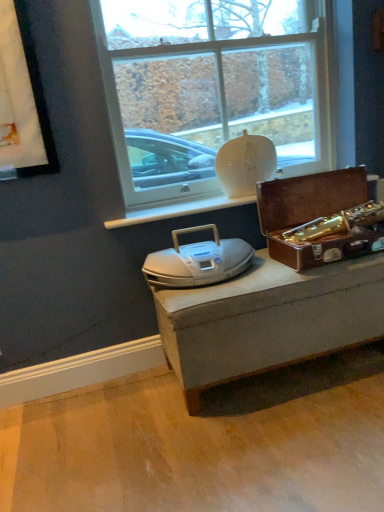
Question: Does white matte vase at upper center appear on the left side of white plastic stereo at center?

Choices:
 (A) yes
 (B) no

Answer: (B)

Question: Is white matte vase at upper center positioned beyond the bounds of white plastic stereo at center?

Choices:
 (A) yes
 (B) no

Answer: (A)

Question: Is white matte vase at upper center bigger than white plastic stereo at center?

Choices:
 (A) yes
 (B) no

Answer: (A)

Question: Does white matte vase at upper center come behind white plastic stereo at center?

Choices:
 (A) yes
 (B) no

Answer: (A)

Question: Does white matte vase at upper center have a smaller size compared to white plastic stereo at center?

Choices:
 (A) no
 (B) yes

Answer: (A)

Question: From a real-world perspective, is white matte vase at upper center on white plastic stereo at center?

Choices:
 (A) yes
 (B) no

Answer: (A)

Question: From the image's perspective, is shiny brown suitcase at right on top of white matte vase at upper center?

Choices:
 (A) yes
 (B) no

Answer: (B)

Question: Considering the relative sizes of shiny brown suitcase at right and white matte vase at upper center in the image provided, is shiny brown suitcase at right smaller than white matte vase at upper center?

Choices:
 (A) no
 (B) yes

Answer: (A)

Question: Are shiny brown suitcase at right and white matte vase at upper center making contact?

Choices:
 (A) no
 (B) yes

Answer: (A)

Question: Is shiny brown suitcase at right taller than white matte vase at upper center?

Choices:
 (A) no
 (B) yes

Answer: (A)

Question: Can you confirm if shiny brown suitcase at right is positioned to the right of white matte vase at upper center?

Choices:
 (A) yes
 (B) no

Answer: (A)

Question: From a real-world perspective, does shiny brown suitcase at right stand above white matte vase at upper center?

Choices:
 (A) no
 (B) yes

Answer: (A)

Question: Is white matte vase at upper center oriented away from shiny brown suitcase at right?

Choices:
 (A) yes
 (B) no

Answer: (B)